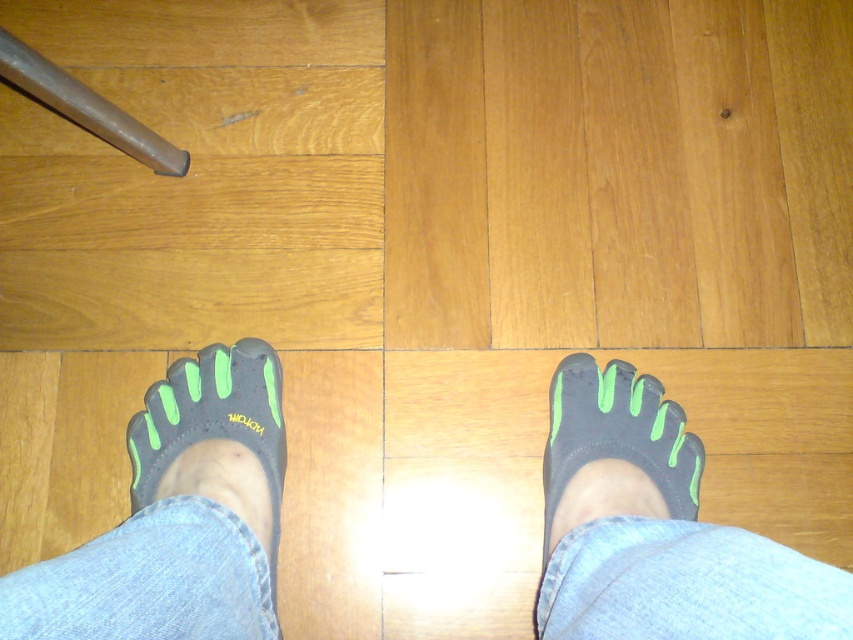
Between black rubber toe socks at center and matte black toe separator at lower center, which one appears on the left side from the viewer's perspective?

black rubber toe socks at center

Which is more to the right, black rubber toe socks at center or matte black toe separator at lower center?

matte black toe separator at lower center is more to the right.

Where is `black rubber toe socks at center`? The image size is (853, 640). black rubber toe socks at center is located at coordinates (657, 529).

Locate an element on the screen. The image size is (853, 640). black rubber toe socks at center is located at coordinates (657, 529).

Who is lower down, black rubber toe socks at center or matte black toe shoe at lower left?

black rubber toe socks at center is lower down.

Between point (115, 557) and point (247, 356), which one is positioned behind?

The point (247, 356) is behind.

Locate an element on the screen. This screenshot has width=853, height=640. black rubber toe socks at center is located at coordinates (657, 529).

Could you measure the distance between matte black toe separator at lower center and matte black toe shoe at lower left?

The distance of matte black toe separator at lower center from matte black toe shoe at lower left is 13.36 inches.

Is matte black toe separator at lower center above matte black toe shoe at lower left?

Incorrect, matte black toe separator at lower center is not positioned above matte black toe shoe at lower left.

Is point (663, 403) closer to camera compared to point (276, 476)?

That is False.

The image size is (853, 640). I want to click on matte black toe separator at lower center, so click(x=618, y=435).